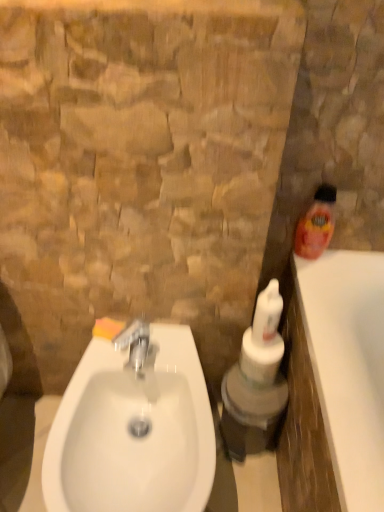
Identify the location of free location in front of orange sponge at sink left. tap(92, 375).